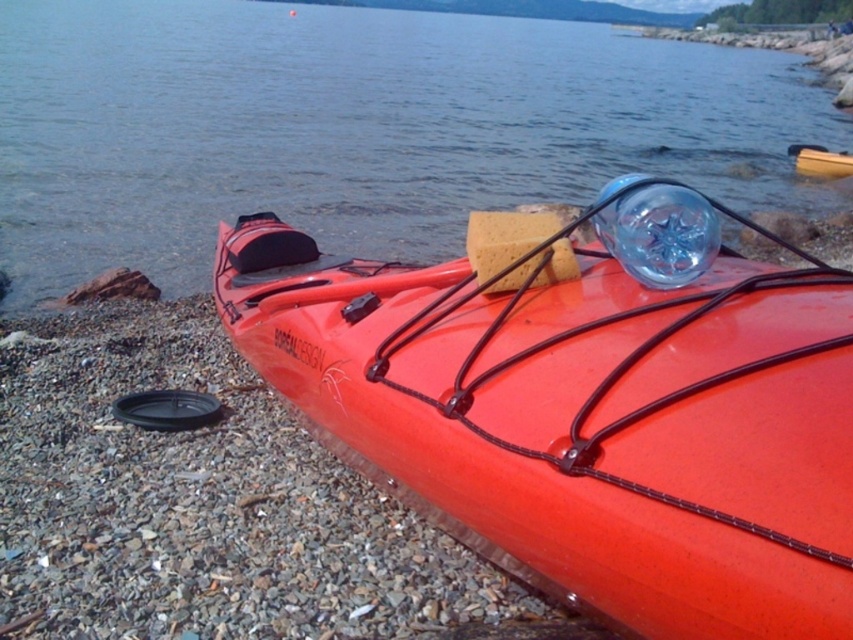
Who is taller, orange matte kayak at center or transparent plastic water at upper center?

Standing taller between the two is transparent plastic water at upper center.

Is point (500, 259) positioned behind point (6, 140)?

No, it is in front of (6, 140).

This screenshot has height=640, width=853. In order to click on orange matte kayak at center in this screenshot , I will do `click(585, 403)`.

Where is `orange matte kayak at center`? The image size is (853, 640). orange matte kayak at center is located at coordinates (585, 403).

Who is more distant from viewer, (331, 285) or (813, 163)?

Point (813, 163)

From the picture: Who is higher up, orange matte kayak at center or orange plastic canoe at center?

orange plastic canoe at center is above.

This screenshot has width=853, height=640. Describe the element at coordinates (585, 403) in the screenshot. I see `orange matte kayak at center` at that location.

This screenshot has height=640, width=853. I want to click on orange matte kayak at center, so click(585, 403).

Is transparent plastic water at upper center below orange plastic canoe at center?

Actually, transparent plastic water at upper center is above orange plastic canoe at center.

Is point (373, 68) behind point (848, 172)?

That is True.

Image resolution: width=853 pixels, height=640 pixels. Describe the element at coordinates (355, 129) in the screenshot. I see `transparent plastic water at upper center` at that location.

Where is `transparent plastic water at upper center`? Image resolution: width=853 pixels, height=640 pixels. transparent plastic water at upper center is located at coordinates (355, 129).